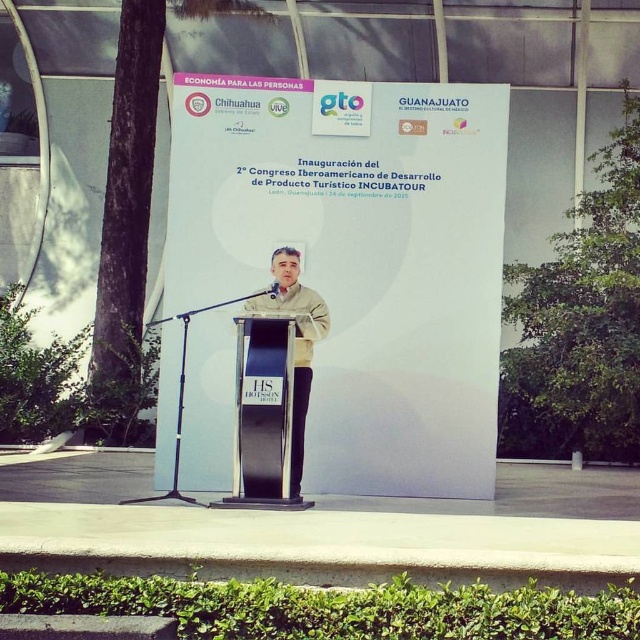
Where is `black polished wood podium at center`? black polished wood podium at center is located at coordinates (264, 416).

Identify the location of black polished wood podium at center. Image resolution: width=640 pixels, height=640 pixels. (264, 416).

Where is `black polished wood podium at center`? The width and height of the screenshot is (640, 640). black polished wood podium at center is located at coordinates (264, 416).